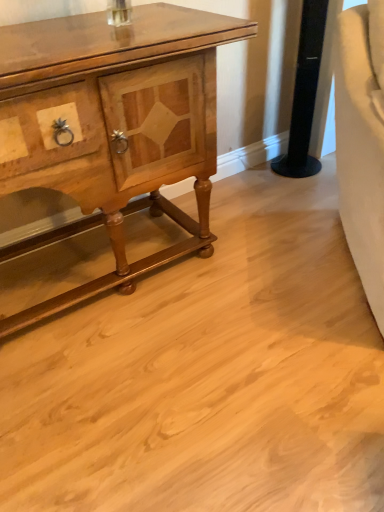
Locate an element on the screen. black glossy speaker at upper right is located at coordinates (304, 94).

Image resolution: width=384 pixels, height=512 pixels. What do you see at coordinates (304, 94) in the screenshot?
I see `black glossy speaker at upper right` at bounding box center [304, 94].

In order to click on wooden polished cabinet at left in this screenshot , I will do `click(112, 127)`.

What do you see at coordinates (112, 127) in the screenshot? The image size is (384, 512). I see `wooden polished cabinet at left` at bounding box center [112, 127].

Where is `black glossy speaker at upper right`? The height and width of the screenshot is (512, 384). black glossy speaker at upper right is located at coordinates [304, 94].

Can you confirm if wooden polished cabinet at left is positioned to the left of black glossy speaker at upper right?

Yes, wooden polished cabinet at left is to the left of black glossy speaker at upper right.

Does wooden polished cabinet at left lie behind black glossy speaker at upper right?

No, it is not.

Which is closer to the camera, (52, 136) or (299, 136)?

Point (52, 136) is closer to the camera than point (299, 136).

From the image's perspective, who appears lower, wooden polished cabinet at left or black glossy speaker at upper right?

From the image's view, wooden polished cabinet at left is below.

From a real-world perspective, between wooden polished cabinet at left and black glossy speaker at upper right, who is vertically lower?

black glossy speaker at upper right is physically lower.

Can you confirm if wooden polished cabinet at left is thinner than black glossy speaker at upper right?

In fact, wooden polished cabinet at left might be wider than black glossy speaker at upper right.

Who is taller, wooden polished cabinet at left or black glossy speaker at upper right?

wooden polished cabinet at left is taller.

Who is smaller, wooden polished cabinet at left or black glossy speaker at upper right?

black glossy speaker at upper right.

Could black glossy speaker at upper right be considered to be inside wooden polished cabinet at left?

Actually, black glossy speaker at upper right is outside wooden polished cabinet at left.

Is wooden polished cabinet at left next to black glossy speaker at upper right?

No, wooden polished cabinet at left is not beside black glossy speaker at upper right.

Is wooden polished cabinet at left facing towards black glossy speaker at upper right?

No, wooden polished cabinet at left is not oriented towards black glossy speaker at upper right.

Identify the location of pillar behind the wooden polished cabinet at left. The image size is (384, 512). (304, 94).

Is black glossy speaker at upper right to the left or to the right of wooden polished cabinet at left in the image?

Clearly, black glossy speaker at upper right is on the right of wooden polished cabinet at left in the image.

Between black glossy speaker at upper right and wooden polished cabinet at left, which one is positioned in front?

wooden polished cabinet at left is more forward.

Does point (311, 105) come closer to viewer compared to point (114, 162)?

No, (311, 105) is further to viewer.

From the image's perspective, is black glossy speaker at upper right above or below wooden polished cabinet at left?

black glossy speaker at upper right is above wooden polished cabinet at left.

From a real-world perspective, is black glossy speaker at upper right positioned above or below wooden polished cabinet at left?

black glossy speaker at upper right is situated lower than wooden polished cabinet at left in the real world.

Can you confirm if black glossy speaker at upper right is wider than wooden polished cabinet at left?

No.

Can you confirm if black glossy speaker at upper right is taller than wooden polished cabinet at left?

No, black glossy speaker at upper right is not taller than wooden polished cabinet at left.

Looking at the image, does black glossy speaker at upper right seem bigger or smaller compared to wooden polished cabinet at left?

Considering their sizes, black glossy speaker at upper right takes up less space than wooden polished cabinet at left.

Is wooden polished cabinet at left inside black glossy speaker at upper right?

That's incorrect, wooden polished cabinet at left is not inside black glossy speaker at upper right.

Is black glossy speaker at upper right with wooden polished cabinet at left?

black glossy speaker at upper right and wooden polished cabinet at left are clearly separated.

Is black glossy speaker at upper right facing away from wooden polished cabinet at left?

black glossy speaker at upper right is not turned away from wooden polished cabinet at left.

Identify the location of chest of drawers that appears on the left of black glossy speaker at upper right. (112, 127).

This screenshot has width=384, height=512. Find the location of `pillar lying behind the wooden polished cabinet at left`. pillar lying behind the wooden polished cabinet at left is located at coordinates (304, 94).

The width and height of the screenshot is (384, 512). In order to click on chest of drawers below the black glossy speaker at upper right (from the image's perspective) in this screenshot , I will do `click(112, 127)`.